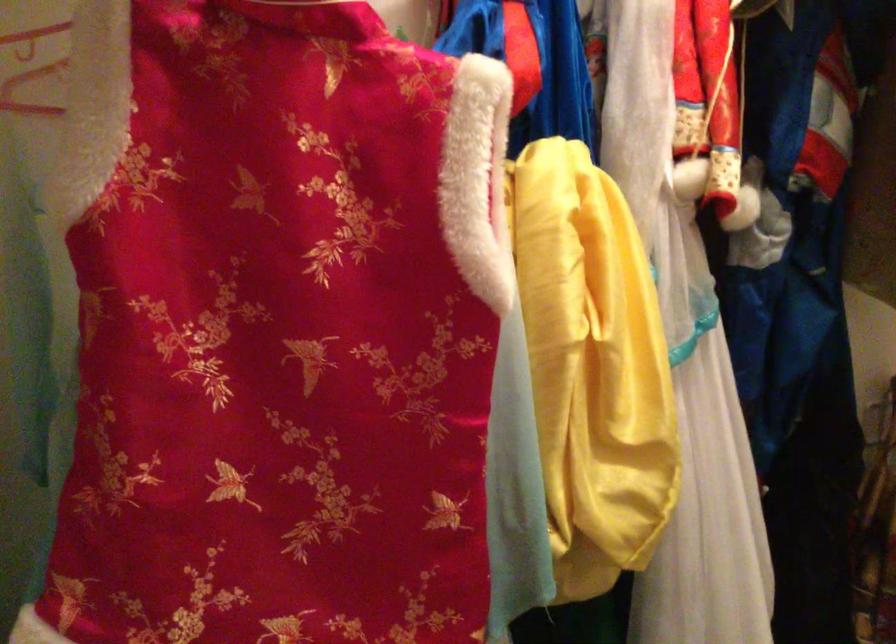
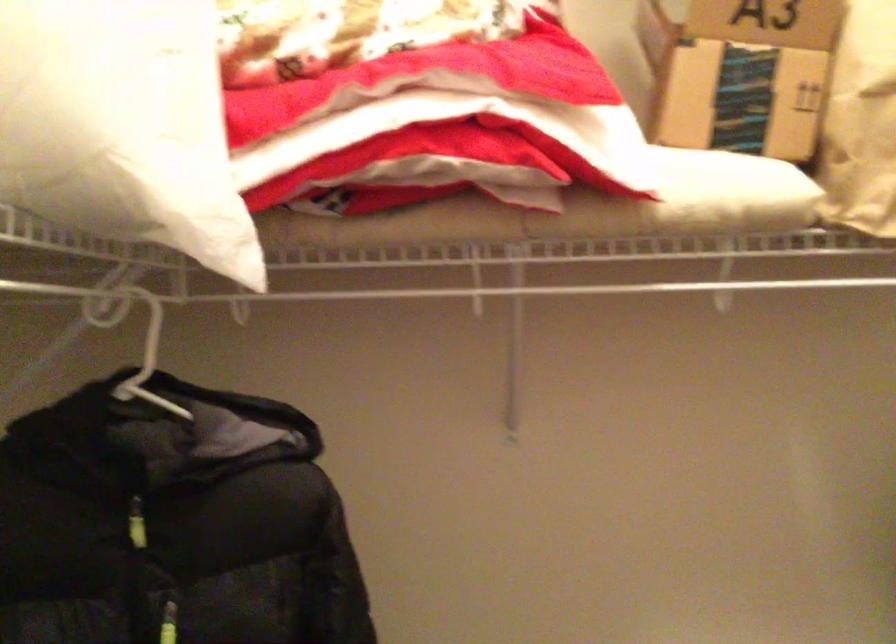
Question: The first image is from the beginning of the video and the second image is from the end. How did the camera likely rotate when shooting the video?

Choices:
 (A) Left
 (B) Right
 (C) Up
 (D) Down

Answer: (A)